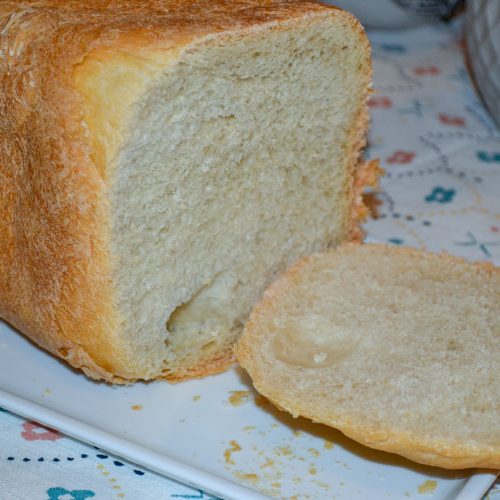
You are a GUI agent. You are given a task and a screenshot of the screen. Output one action in this format:
    pyautogui.click(x=<x>, y=<y>)
    Task: Click on the tablecloth
    The width and height of the screenshot is (500, 500).
    Given the screenshot: What is the action you would take?
    pyautogui.click(x=89, y=483)